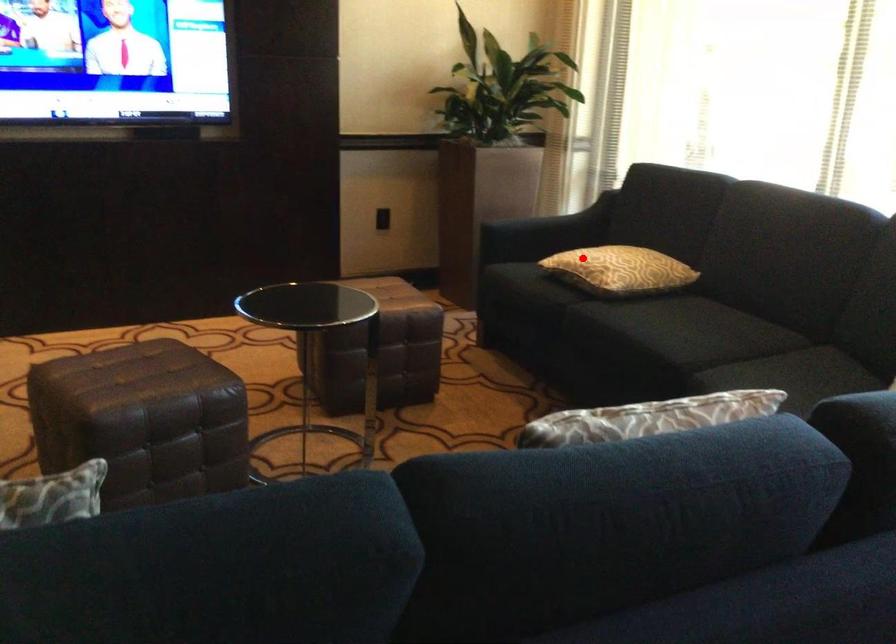
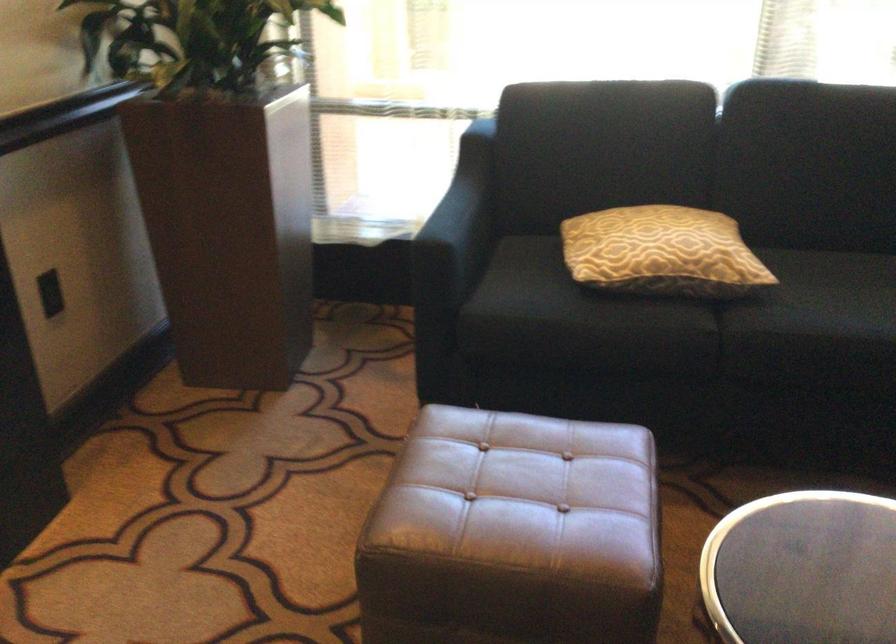
Question: I am providing you with two images of the same scene from different viewpoints. Image1 has a red point marked. In image2, the corresponding 3D location appears at what relative position? Reply with the corresponding letter.

Choices:
 (A) Closer
 (B) Farther

Answer: (A)